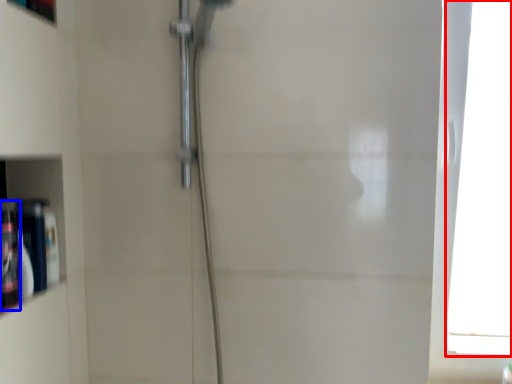
Question: Which object appears farthest to the camera in this image, window (highlighted by a red box) or toiletry (highlighted by a blue box)?

Choices:
 (A) window
 (B) toiletry

Answer: (A)